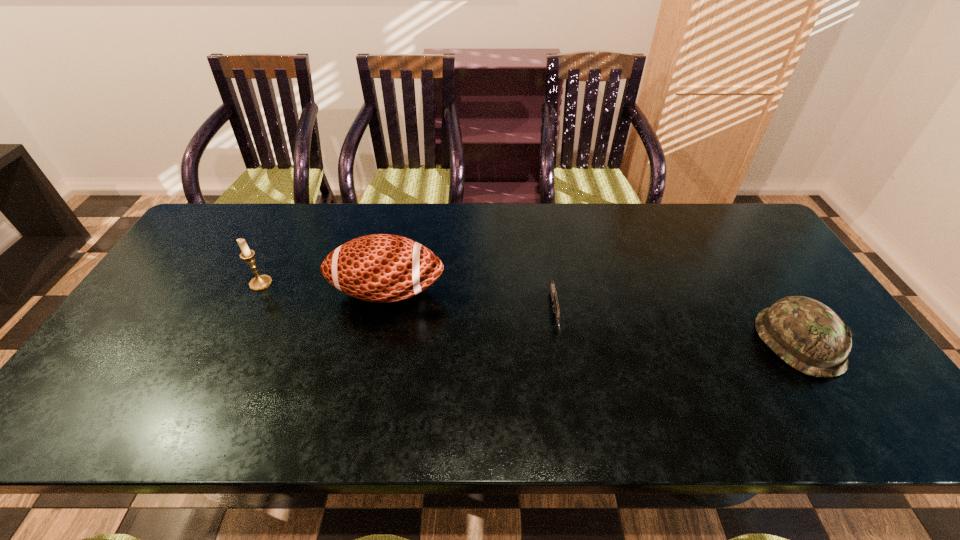
I want to click on free space between the candle holder and the shortest object, so (408, 299).

Where is `free space between the shortest object and the leftmost object`? The height and width of the screenshot is (540, 960). free space between the shortest object and the leftmost object is located at coordinates (408, 299).

This screenshot has height=540, width=960. Find the location of `free spot between the shortest object and the football`. free spot between the shortest object and the football is located at coordinates (471, 303).

Where is `vacant space that's between the leftmost object and the gun`? vacant space that's between the leftmost object and the gun is located at coordinates (408, 299).

Identify which object is the third nearest to the rightmost object. Please provide its 2D coordinates. Your answer should be formatted as a tuple, i.e. [(x, y)], where the tuple contains the x and y coordinates of a point satisfying the conditions above.

[(260, 282)]

Find the location of a particular element. The width and height of the screenshot is (960, 540). the third closest object to the second object from right to left is located at coordinates (260, 282).

Where is `vacant point that satisfies the following two spatial constraints: 1. aimed along the barrel of the shortest object; 2. on the right side of the rightmost object`? vacant point that satisfies the following two spatial constraints: 1. aimed along the barrel of the shortest object; 2. on the right side of the rightmost object is located at coordinates (560, 342).

You are a GUI agent. You are given a task and a screenshot of the screen. Output one action in this format:
    pyautogui.click(x=<x>, y=<y>)
    Task: Click on the free space in the image that satisfies the following two spatial constraints: 1. on the front side of the football; 2. on the right side of the leftmost object
    This screenshot has height=540, width=960.
    Given the screenshot: What is the action you would take?
    pyautogui.click(x=256, y=292)

Where is `free location that satisfies the following two spatial constraints: 1. aimed along the barrel of the headwear; 2. on the left side of the gun`? Image resolution: width=960 pixels, height=540 pixels. free location that satisfies the following two spatial constraints: 1. aimed along the barrel of the headwear; 2. on the left side of the gun is located at coordinates (560, 342).